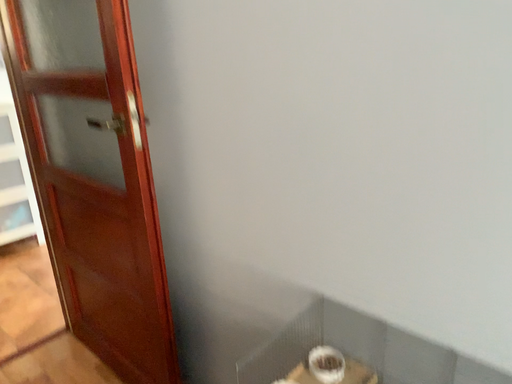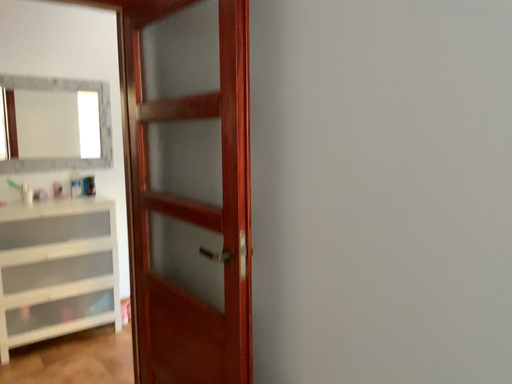
Question: How did the camera likely rotate when shooting the video?

Choices:
 (A) rotated downward
 (B) rotated upward

Answer: (B)